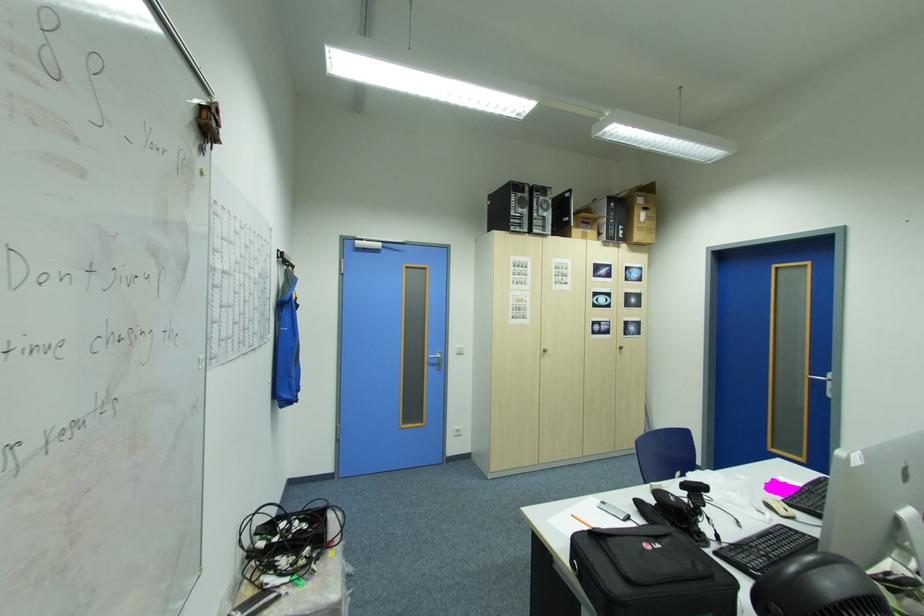
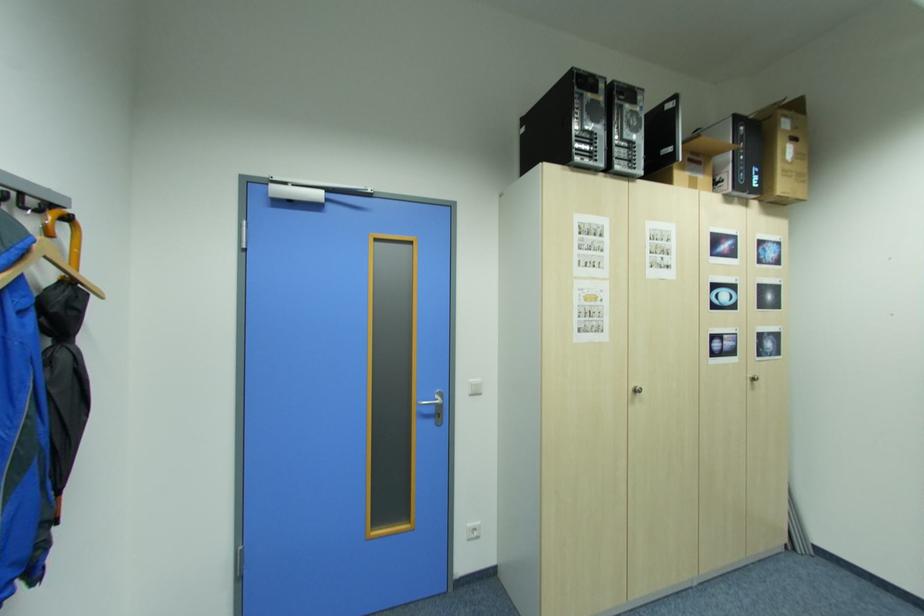
Question: I am providing you with two images of the same scene from different viewpoints. Please identify which objects are invisible in image2.

Choices:
 (A) white light switch
 (B) grey coat hook
 (C) wooden clothes hanger
 (D) none of these

Answer: (D)